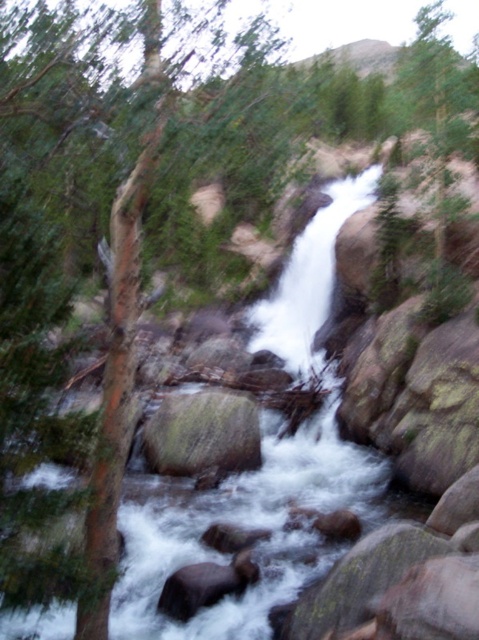
Where is `green mossy rock at center`? Image resolution: width=479 pixels, height=640 pixels. green mossy rock at center is located at coordinates (203, 433).

Does green mossy rock at center lie in front of smooth brown rock at center?

No.

Locate an element on the screen. The width and height of the screenshot is (479, 640). green mossy rock at center is located at coordinates (203, 433).

Where is `green mossy rock at center`? green mossy rock at center is located at coordinates (203, 433).